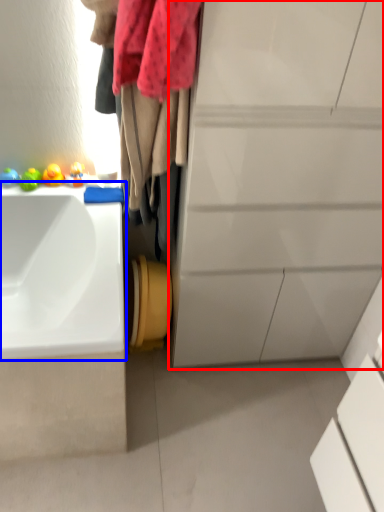
Question: Among these objects, which one is farthest to the camera, bathroom cabinet (highlighted by a red box) or sink (highlighted by a blue box)?

Choices:
 (A) bathroom cabinet
 (B) sink

Answer: (B)